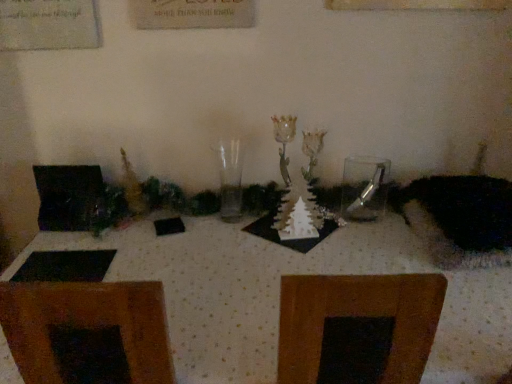
Find the location of a particular element. vacant space situated on the left part of transparent glass vase at center is located at coordinates (192, 214).